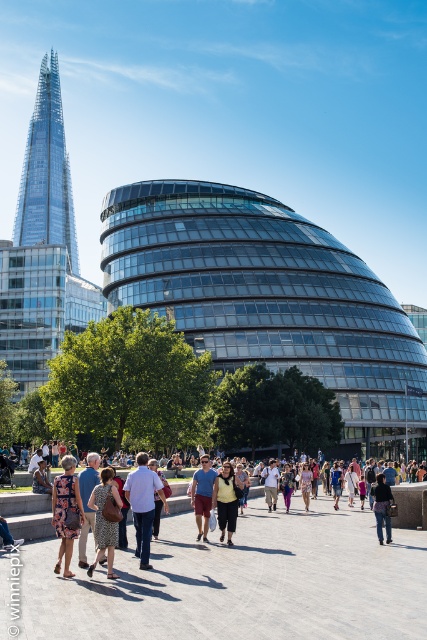
Between denim jacket at center and blue denim jeans at center, which one has more height?

blue denim jeans at center is taller.

Is denim jacket at center bigger than blue denim jeans at center?

Indeed, denim jacket at center has a larger size compared to blue denim jeans at center.

Which is in front, point (37, 476) or point (339, 484)?

Point (37, 476) is more forward.

This screenshot has height=640, width=427. Find the location of `denim jacket at center`. denim jacket at center is located at coordinates (40, 480).

Is yellow matte vest at center taller than denim shorts at center?

Correct, yellow matte vest at center is much taller as denim shorts at center.

Where is `yellow matte vest at center`? Image resolution: width=427 pixels, height=640 pixels. yellow matte vest at center is located at coordinates pos(227,500).

Who is more forward, (230, 512) or (309, 468)?

Point (230, 512) is more forward.

Locate an element on the screen. The width and height of the screenshot is (427, 640). yellow matte vest at center is located at coordinates (227, 500).

Can you confirm if printed fabric dress at center is smaller than denim shorts at center?

Yes.

Between point (114, 572) and point (307, 468), which one is positioned behind?

Point (307, 468)

Who is more forward, (x=108, y=557) or (x=304, y=483)?

Positioned in front is point (x=108, y=557).

Find the location of a particular element. This screenshot has width=427, height=640. printed fabric dress at center is located at coordinates (105, 520).